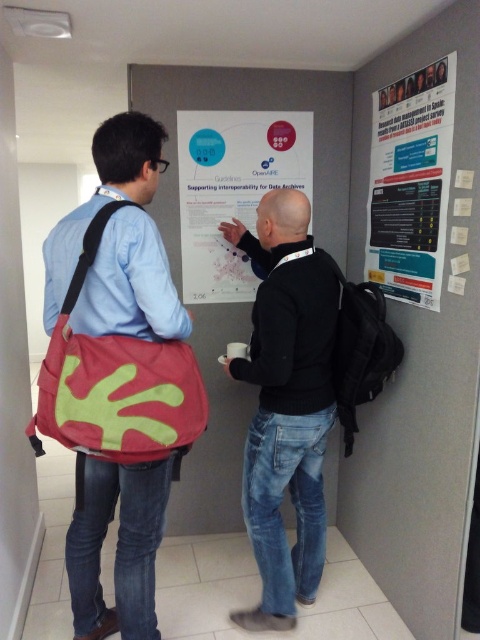
Is matte fabric bag at left to the right of white paper at upper right from the viewer's perspective?

Incorrect, matte fabric bag at left is not on the right side of white paper at upper right.

Is point (169, 273) behind point (385, 205)?

No, it is in front of (385, 205).

Between point (144, 612) and point (428, 97), which one is positioned in front?

Positioned in front is point (144, 612).

Find the location of `matte fabric bag at left`. matte fabric bag at left is located at coordinates (119, 243).

Is point (104, 232) positioned behind point (257, 422)?

No, (104, 232) is in front of (257, 422).

Who is positioned more to the right, matte fabric bag at left or black matte jacket at center?

black matte jacket at center

Locate an element on the screen. matte fabric bag at left is located at coordinates (119, 243).

Is matte fabric bag at left bigger than matte paper poster at center?

Indeed, matte fabric bag at left has a larger size compared to matte paper poster at center.

Is point (156, 513) positioned after point (199, 237)?

No, (156, 513) is closer to viewer.

The height and width of the screenshot is (640, 480). I want to click on matte fabric bag at left, so click(119, 243).